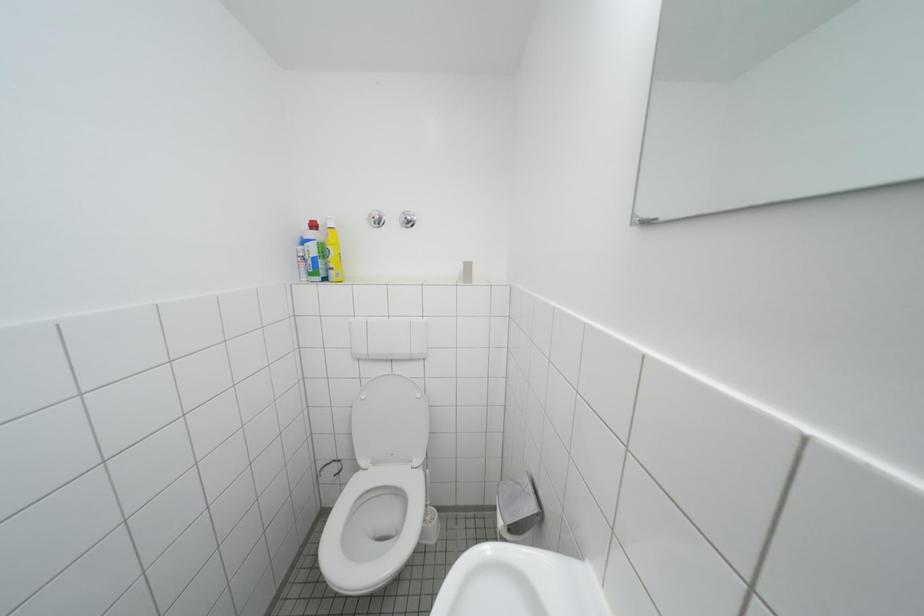
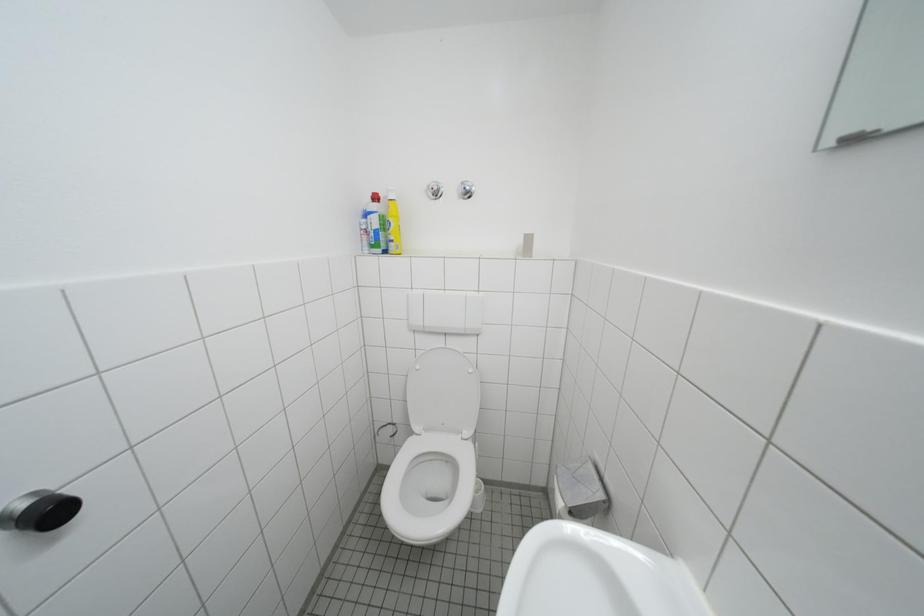
Question: The images are taken continuously from a first-person perspective. In which direction is your viewpoint rotating?

Choices:
 (A) Left
 (B) Right
 (C) Up
 (D) Down

Answer: (A)